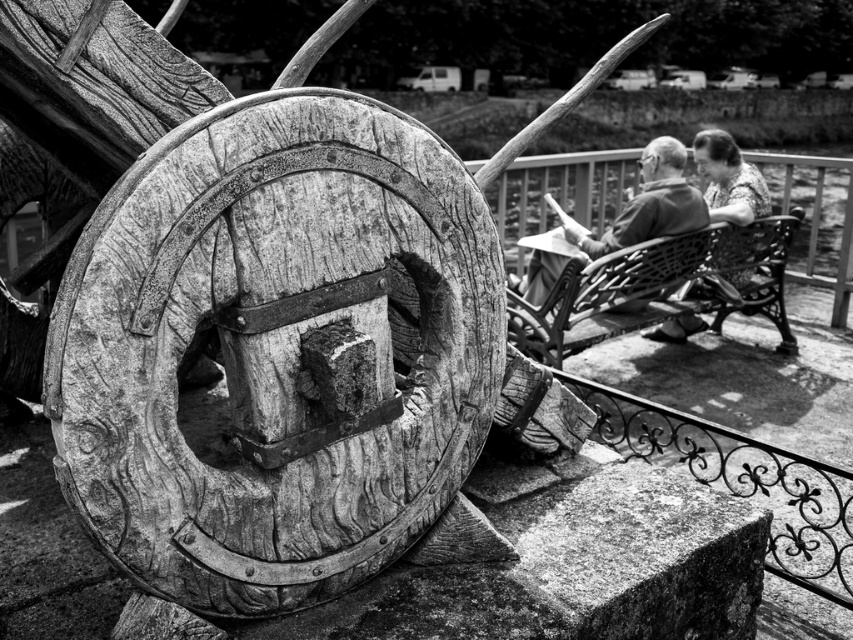
You are standing at the base of the aged wooden wheel and want to reach the smooth wood chair at upper right. The path between them is clear. Can you walk directly to the chair without any obstacles?

Yes, the path between the aged wooden wheel and the smooth wood chair at upper right is clear, so you can walk directly to the chair without any obstacles.

You are standing at the center of the image. Which direction should you move to reach the woven wicker bench at right?

You should move to the right to reach the woven wicker bench at right since it is located at the right side of the image.

Consider the image. You are a photographer trying to capture both the woven wicker bench at right and the smooth fabric blouse at upper right in the same frame. Which object should you focus on first to ensure both are in the shot?

The woven wicker bench at right is taller than the smooth fabric blouse at upper right, so you should focus on the woven wicker bench at right first to ensure both are in the frame.